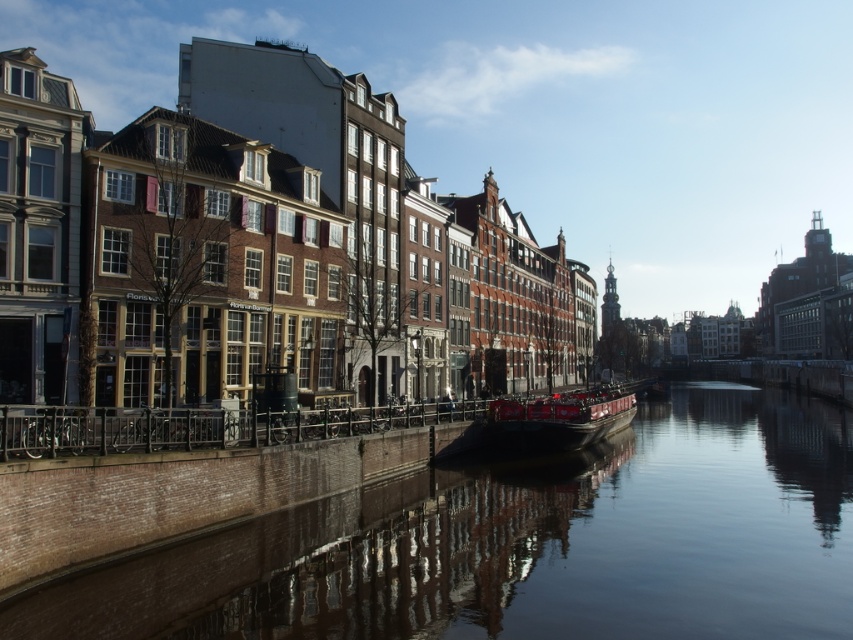
You are a tour guide planning to navigate the red wooden boat at center through the smooth concrete canal at center. Based on the canal and boat dimensions, can the boat pass through the canal without touching the sides?

The smooth concrete canal at center might be wider than red wooden boat at center, so there is a possibility that the boat can pass through without touching the sides. However, the exact dimensions are uncertain, so caution is advised.

You are standing at the edge of the canal and want to place a floating marker at the exact center of the smooth concrete canal at center. According to the coordinates provided, where should you place it?

The smooth concrete canal at center should be placed at coordinates point (526, 545).

You are standing on the bank of the canal and want to take a photo of both the smooth concrete canal at center and the red wooden boat at center. Which object will appear larger in your photo?

The smooth concrete canal at center will appear larger in the photo because it is closer to the viewer than the red wooden boat at center.